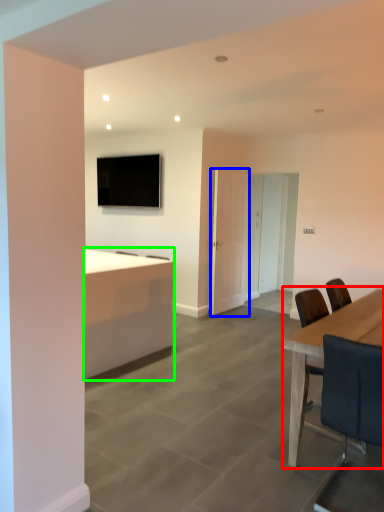
Question: Which object is the farthest from table (highlighted by a red box)? Choose among these: door (highlighted by a blue box) or desk (highlighted by a green box).

Choices:
 (A) door
 (B) desk

Answer: (A)